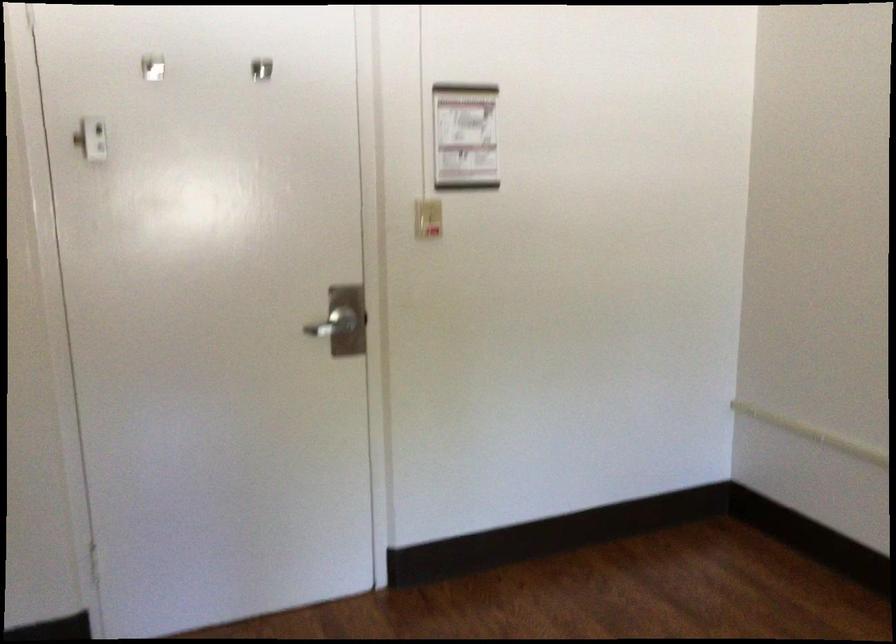
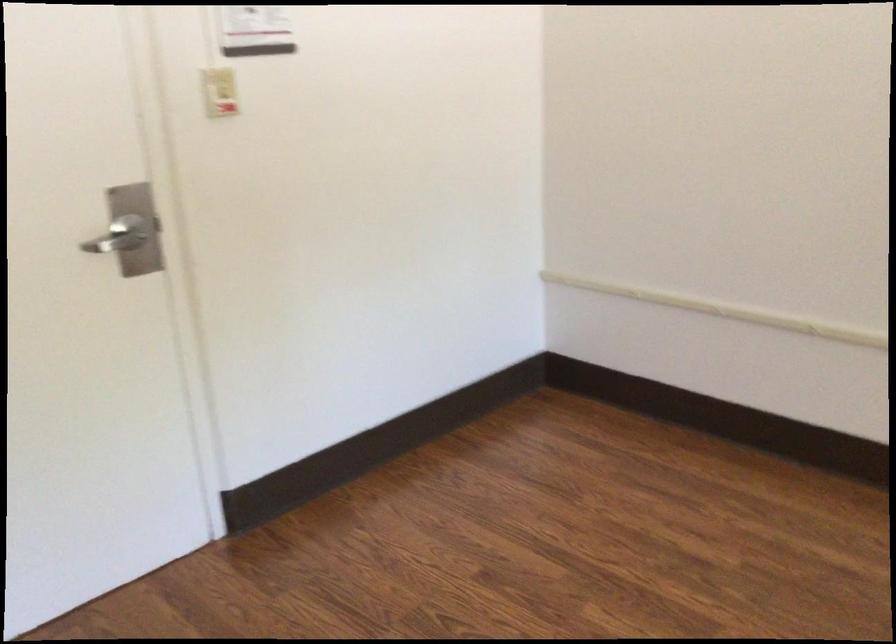
Question: The camera is either moving clockwise (left) or counter-clockwise (right) around the object. The first image is from the beginning of the video and the second image is from the end. Is the camera moving left or right when shooting the video?

Choices:
 (A) Left
 (B) Right

Answer: (A)